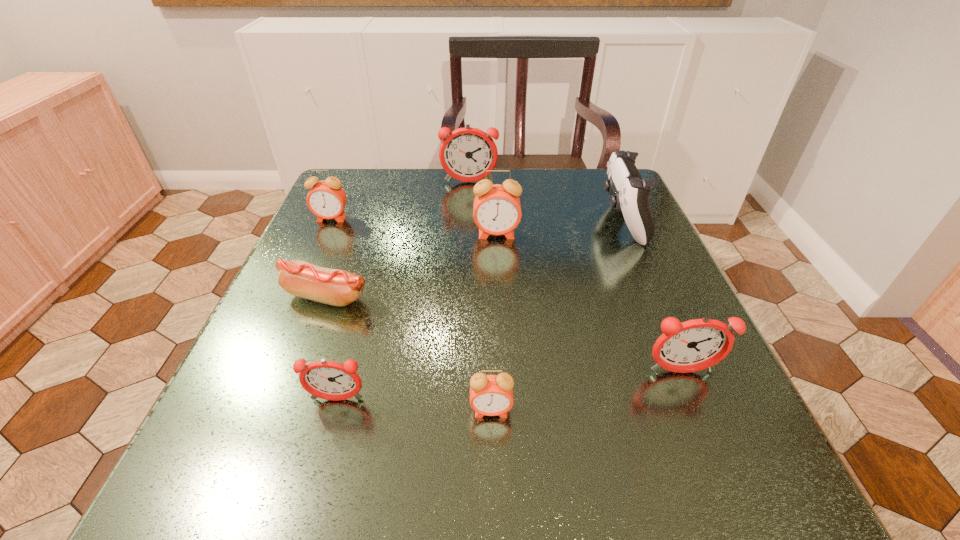
In order to click on the farthest alarm clock in this screenshot , I will do `click(465, 154)`.

Identify the location of the farthest object. The width and height of the screenshot is (960, 540). pyautogui.click(x=465, y=154).

The image size is (960, 540). I want to click on the second nearest pink alarm clock, so click(x=496, y=210).

Where is `the fourth nearest alarm clock`? The image size is (960, 540). the fourth nearest alarm clock is located at coordinates (496, 210).

Where is `control`? The height and width of the screenshot is (540, 960). control is located at coordinates (631, 192).

At what (x,y) coordinates should I click in order to perform the action: click on the second biggest pink alarm clock. Please return your answer as a coordinate pair (x, y). Looking at the image, I should click on (326, 199).

Where is `the farthest pink alarm clock`? This screenshot has width=960, height=540. the farthest pink alarm clock is located at coordinates (326, 199).

You are a GUI agent. You are given a task and a screenshot of the screen. Output one action in this format:
    pyautogui.click(x=<x>, y=<y>)
    Task: Click on the rightmost alarm clock
    
    Given the screenshot: What is the action you would take?
    pyautogui.click(x=694, y=345)

Locate an element on the screen. This screenshot has width=960, height=540. the rightmost reddish-pink alarm clock is located at coordinates (694, 345).

I want to click on the leftmost reddish-pink alarm clock, so click(329, 380).